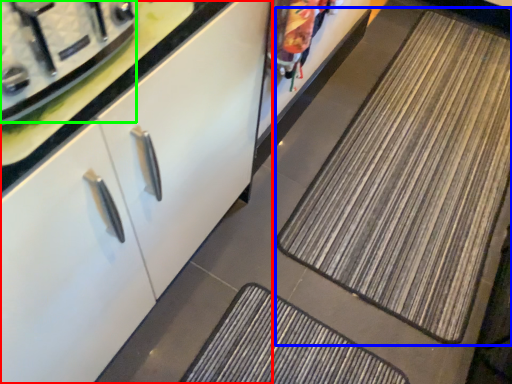
Question: Considering the real-world distances, which object is closest to cabinetry (highlighted by a red box)? mat (highlighted by a blue box) or appliance (highlighted by a green box).

Choices:
 (A) mat
 (B) appliance

Answer: (B)